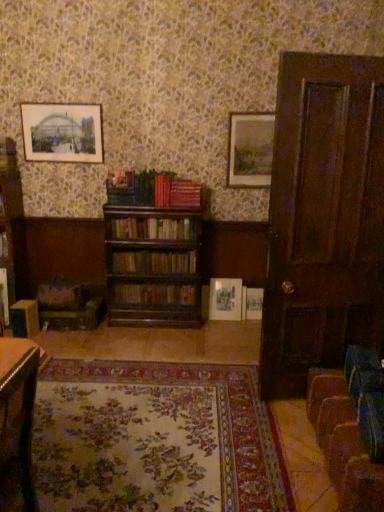
Question: Is matte gold picture frame at center, which ranks as the 2th picture frame in bottom-to-top order, aimed at wooden swivel chair at lower left, the 2th swivel chair ordered from the bottom?

Choices:
 (A) no
 (B) yes

Answer: (A)

Question: Is matte gold picture frame at center, which appears as the 2th picture frame when viewed from the left, bigger than wooden swivel chair at lower left, acting as the second swivel chair starting from the front?

Choices:
 (A) yes
 (B) no

Answer: (B)

Question: From the image's perspective, does matte gold picture frame at center, which is the third picture frame in right-to-left order, appear lower than wooden swivel chair at lower left, the first swivel chair viewed from the top?

Choices:
 (A) no
 (B) yes

Answer: (A)

Question: Is matte gold picture frame at center, the third picture frame from the top, oriented away from wooden swivel chair at lower left, arranged as the 1th swivel chair when viewed from the left?

Choices:
 (A) no
 (B) yes

Answer: (A)

Question: From the image's perspective, is matte gold picture frame at center, the third picture frame from the top, over wooden swivel chair at lower left, arranged as the 1th swivel chair when viewed from the left?

Choices:
 (A) no
 (B) yes

Answer: (B)

Question: Considering the positions of point (77, 136) and point (306, 371), is point (77, 136) closer or farther from the camera than point (306, 371)?

Choices:
 (A) farther
 (B) closer

Answer: (A)

Question: Based on their sizes in the image, would you say black paper picture frame at upper left, arranged as the 4th picture frame when viewed from the right, is bigger or smaller than dark wood door at right?

Choices:
 (A) small
 (B) big

Answer: (A)

Question: Looking at their shapes, would you say black paper picture frame at upper left, which is the 4th picture frame in bottom-to-top order, is wider or thinner than dark wood door at right?

Choices:
 (A) wide
 (B) thin

Answer: (B)

Question: From their relative heights in the image, would you say black paper picture frame at upper left, the first picture frame in the top-to-bottom sequence, is taller or shorter than dark wood door at right?

Choices:
 (A) short
 (B) tall

Answer: (A)

Question: Is matte wooden picture frame at upper right, which ranks as the 3th picture frame in left-to-right order, bigger or smaller than floral carpet at center?

Choices:
 (A) small
 (B) big

Answer: (A)

Question: Do you think matte wooden picture frame at upper right, placed as the second picture frame when sorted from right to left, is within floral carpet at center, or outside of it?

Choices:
 (A) inside
 (B) outside

Answer: (B)

Question: From the image's perspective, is matte wooden picture frame at upper right, placed as the second picture frame when sorted from right to left, located above or below floral carpet at center?

Choices:
 (A) above
 (B) below

Answer: (A)

Question: From a real-world perspective, is matte wooden picture frame at upper right, the third picture frame when ordered from bottom to top, above or below floral carpet at center?

Choices:
 (A) above
 (B) below

Answer: (A)

Question: Is matte white picture frame at center, which appears as the first picture frame when ordered from the bottom, situated inside matte gold picture frame at center, which is the third picture frame in right-to-left order, or outside?

Choices:
 (A) inside
 (B) outside

Answer: (B)

Question: From the image's perspective, is matte white picture frame at center, marked as the 1th picture frame in a right-to-left arrangement, positioned above or below matte gold picture frame at center, which is the third picture frame in right-to-left order?

Choices:
 (A) above
 (B) below

Answer: (B)